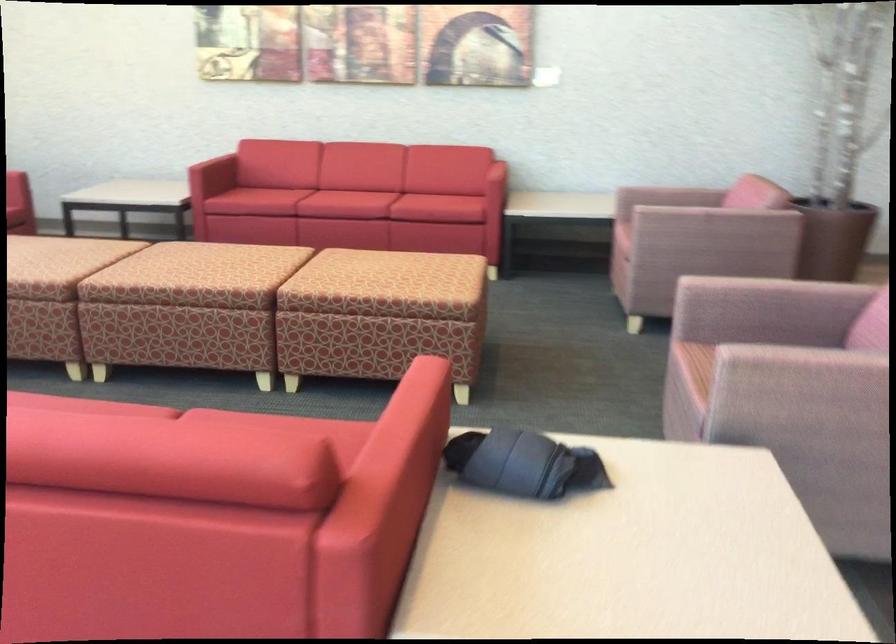
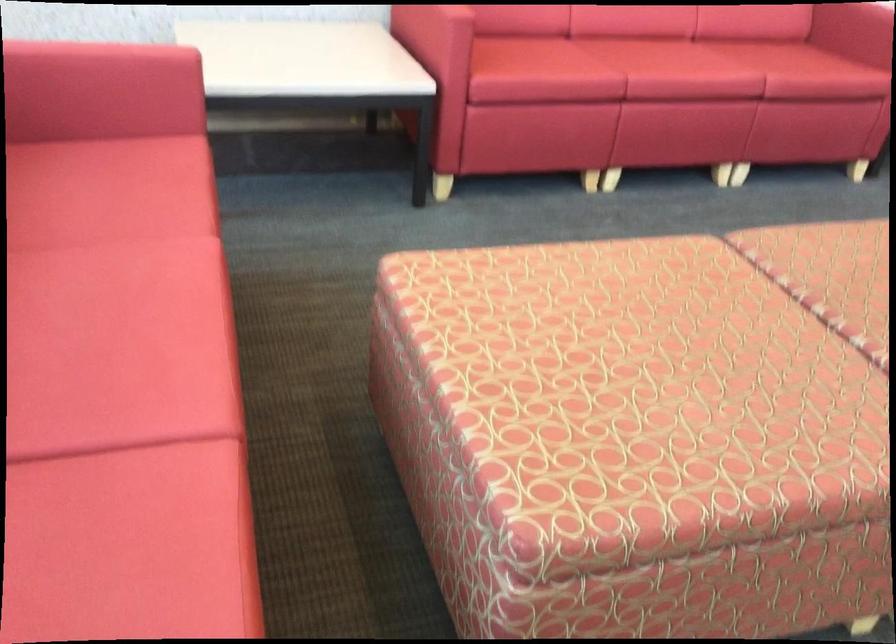
Which direction would the cameraman need to move to produce the second image?

The cameraman moved toward left, forward.